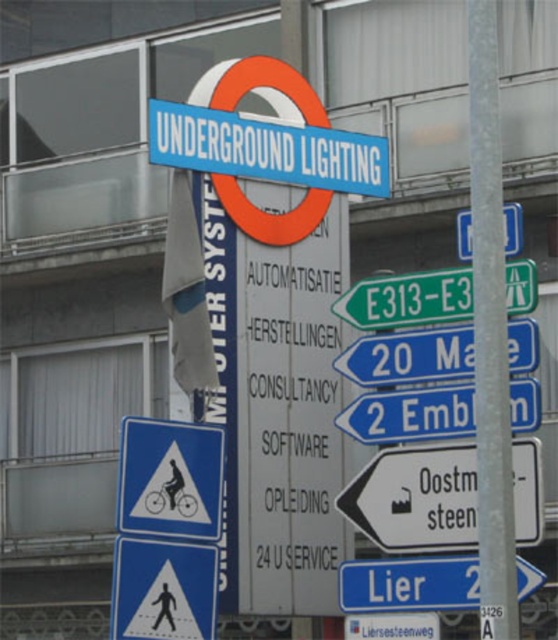
Looking at this image, does white plastic sign at lower right have a larger size compared to white plastic sign at upper center?

Incorrect, white plastic sign at lower right is not larger than white plastic sign at upper center.

Between white plastic sign at lower right and white plastic sign at upper center, which one is positioned higher?

white plastic sign at upper center is higher up.

Who is more forward, (x=538, y=456) or (x=521, y=221)?

Point (x=521, y=221) is in front.

The width and height of the screenshot is (558, 640). What are the coordinates of `white plastic sign at lower right` in the screenshot? It's located at (416, 499).

Does white plastic pedestrian crossing sign at lower left have a lesser height compared to green plastic road sign at center?

No.

Who is shorter, white plastic pedestrian crossing sign at lower left or green plastic road sign at center?

Standing shorter between the two is green plastic road sign at center.

Between point (145, 618) and point (377, 328), which one is positioned behind?

Positioned behind is point (145, 618).

This screenshot has width=558, height=640. What are the coordinates of `white plastic pedestrian crossing sign at lower left` in the screenshot? It's located at (162, 589).

Who is shorter, white plastic sign at lower right or green plastic road sign at center?

Standing shorter between the two is green plastic road sign at center.

Does point (517, 477) come in front of point (352, 292)?

Yes, point (517, 477) is in front of point (352, 292).

You are a GUI agent. You are given a task and a screenshot of the screen. Output one action in this format:
    pyautogui.click(x=<x>, y=<y>)
    Task: Click on the white plastic sign at lower right
    Image resolution: width=558 pixels, height=640 pixels.
    Given the screenshot: What is the action you would take?
    pyautogui.click(x=416, y=499)

Locate an element on the screen. The width and height of the screenshot is (558, 640). white plastic sign at lower right is located at coordinates (416, 499).